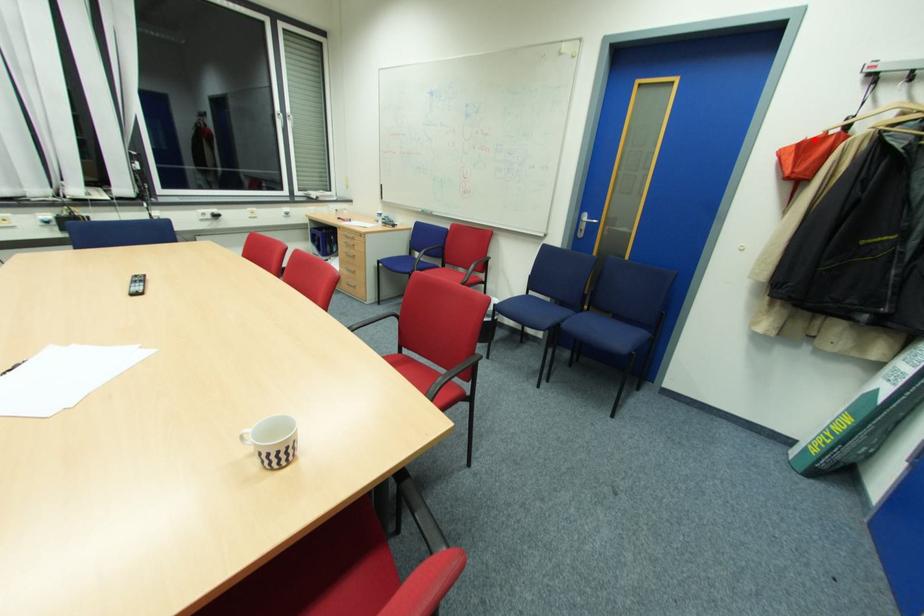
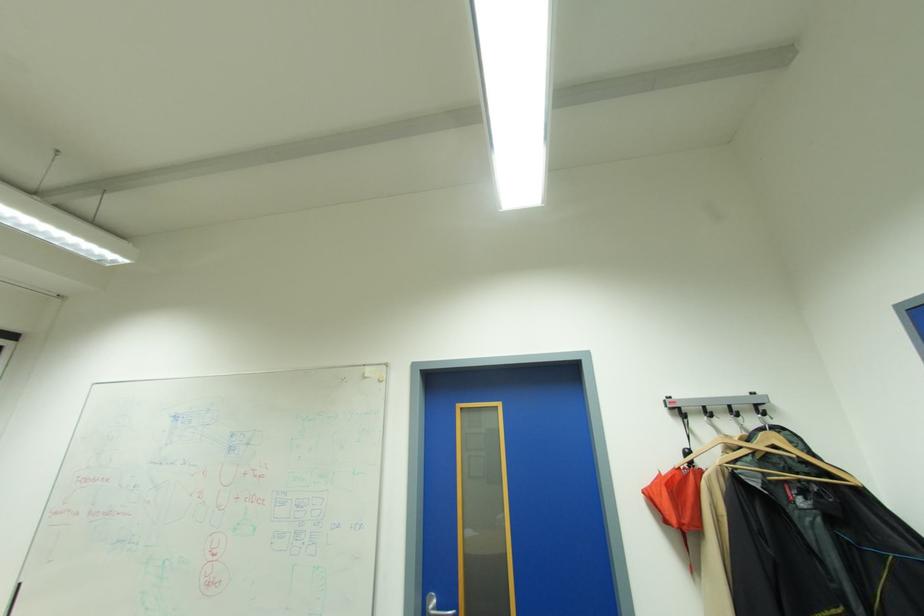
Find the pixel in the second image that matches the highlighted location in the first image.

(667, 474)